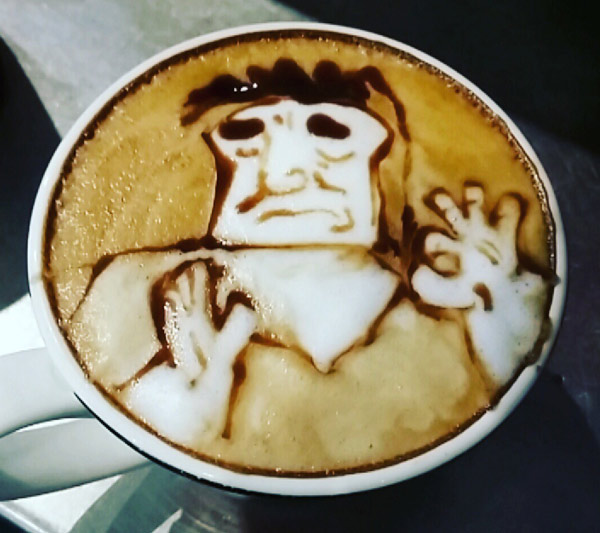
You are a GUI agent. You are given a task and a screenshot of the screen. Output one action in this format:
    pyautogui.click(x=<x>, y=<y>)
    Task: Click on the tabletop
    Image resolution: width=600 pixels, height=533 pixels.
    Given the screenshot: What is the action you would take?
    pyautogui.click(x=177, y=514), pyautogui.click(x=477, y=492)